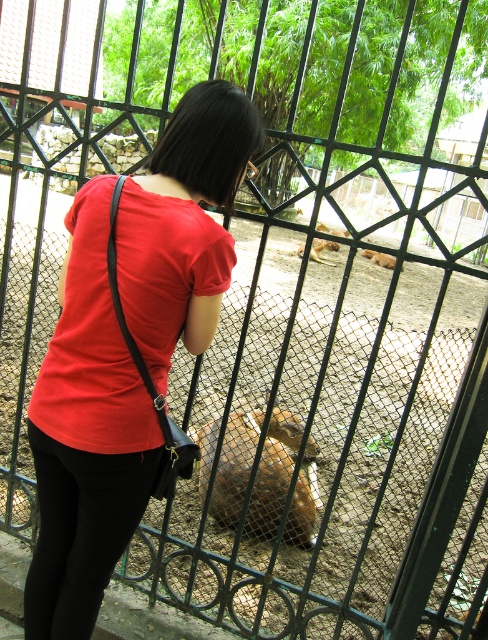
You are a zookeeper who needs to feed the animals. You have two types of feeders, one small and one large. The small feeder can only hold enough food for animals smaller than the brown furry deer at center. Which feeder should you use for the brown furry animal at center?

The brown furry animal at center has a smaller size compared to brown furry deer at center, so you should use the small feeder for the brown furry animal at center.

You are a photographer trying to capture a clear shot of the brown furry deer at center through the fence. The matte red shirt at center is blocking your view. Can you still take the photo without moving the shirt?

The matte red shirt at center is closer to the viewer than the brown furry deer at center, so the shirt will block the view of the deer. You cannot take the photo without moving the shirt.